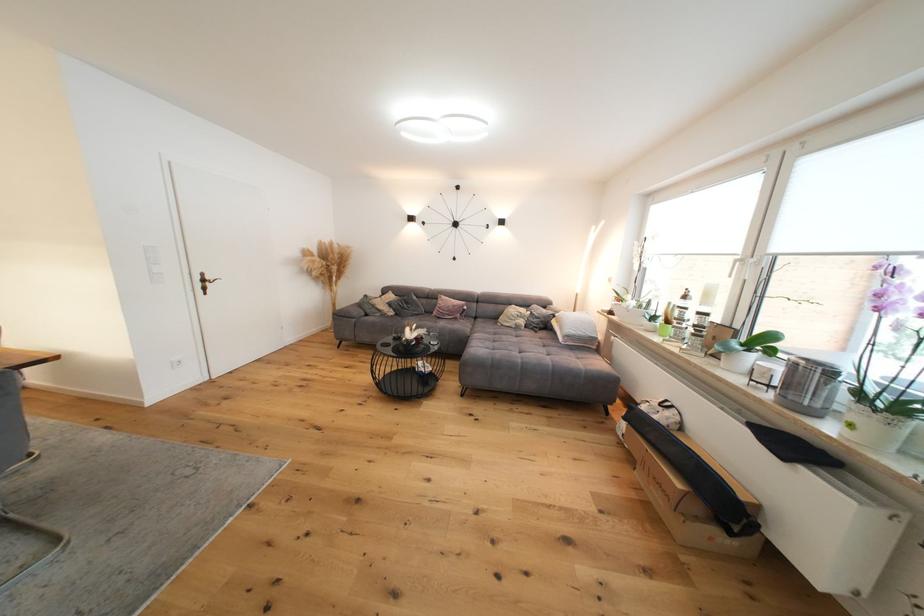
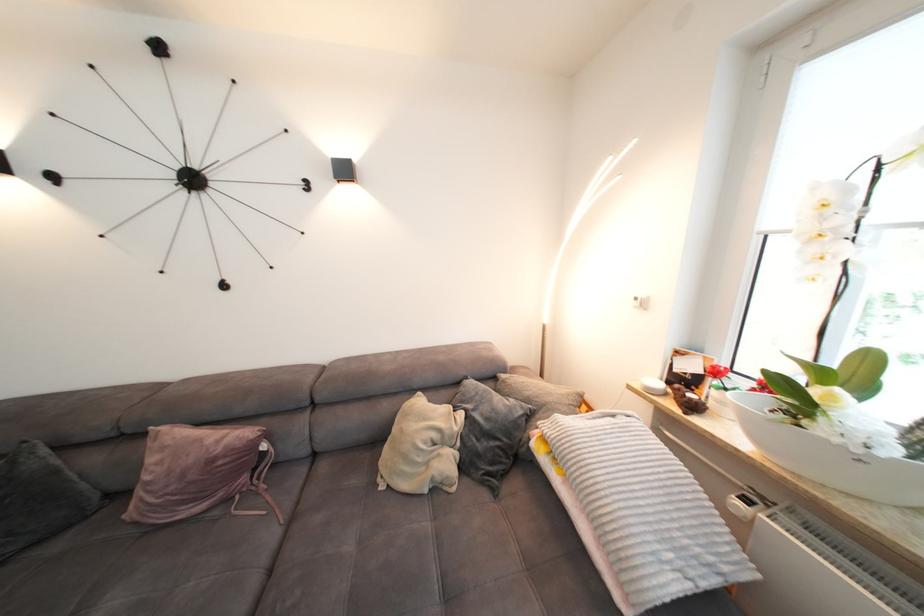
Find the pixel in the second image that matches pixel 611 313 in the first image.

(657, 391)